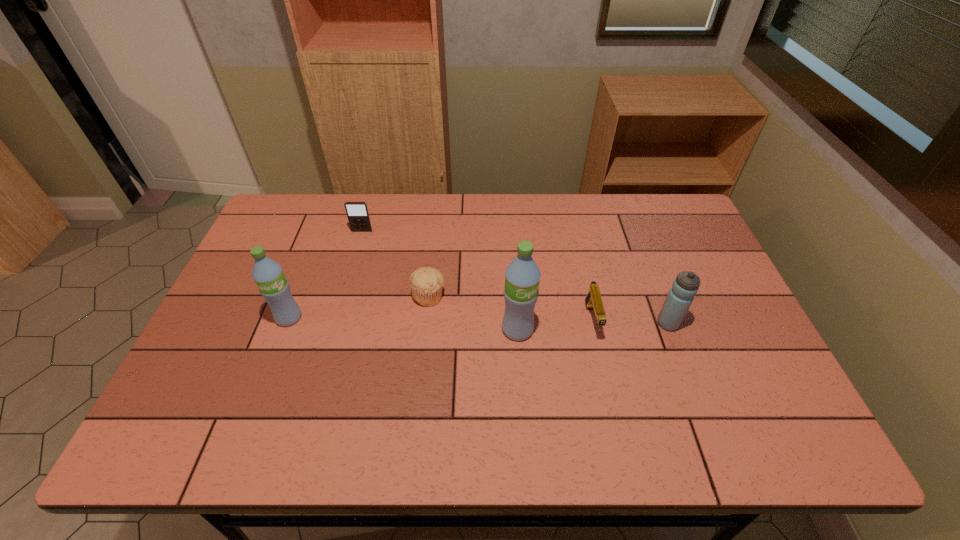
Identify the location of vacant space that satisfies the following two spatial constraints: 1. on the front-facing side of the muffin; 2. on the left side of the second object from left to right. (344, 295).

This screenshot has width=960, height=540. I want to click on vacant space that satisfies the following two spatial constraints: 1. at the barrel of the third tallest object; 2. on the right side of the pistol, so click(592, 323).

In order to click on free location that satisfies the following two spatial constraints: 1. on the front-facing side of the fourth object from left to right; 2. on the left side of the second object from left to right in this screenshot , I will do `click(334, 329)`.

You are a GUI agent. You are given a task and a screenshot of the screen. Output one action in this format:
    pyautogui.click(x=<x>, y=<y>)
    Task: Click on the free spot that satisfies the following two spatial constraints: 1. at the barrel of the shortest water bottle; 2. on the right side of the fifth object from left to right
    
    Given the screenshot: What is the action you would take?
    pyautogui.click(x=592, y=323)